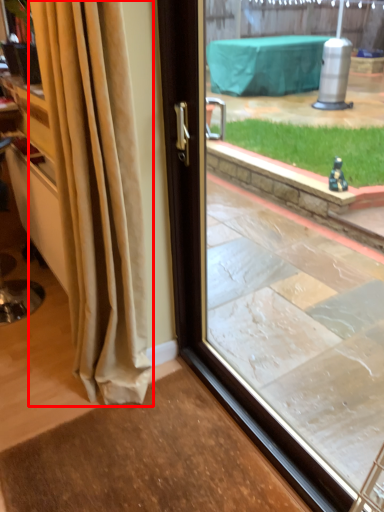
Question: From the image's perspective, where is curtain (annotated by the red box) located relative to window?

Choices:
 (A) below
 (B) above

Answer: (B)